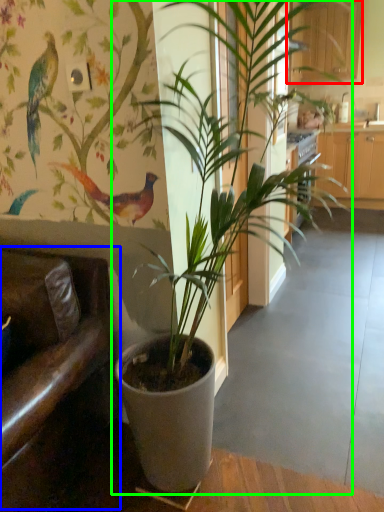
Question: Which object is positioned closest to furniture (highlighted by a red box)? Select from armchair (highlighted by a blue box) and houseplant (highlighted by a green box).

Choices:
 (A) armchair
 (B) houseplant

Answer: (B)